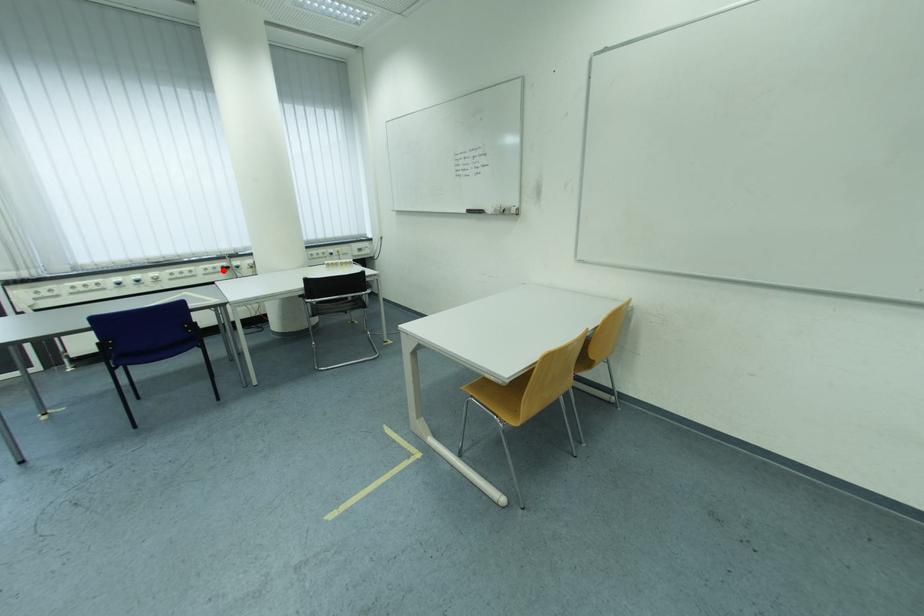
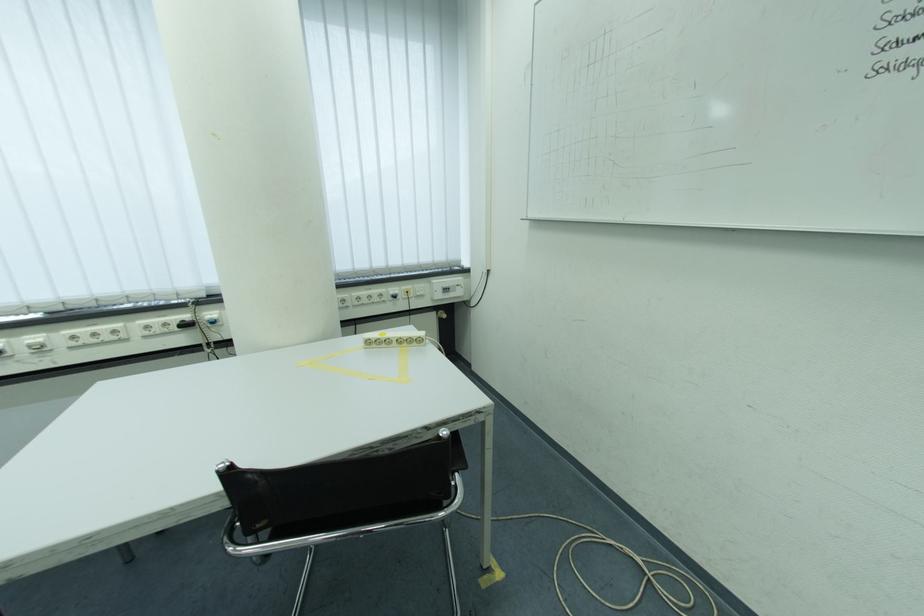
Find the pixel in the second image that matches the highlighted location in the first image.

(175, 326)